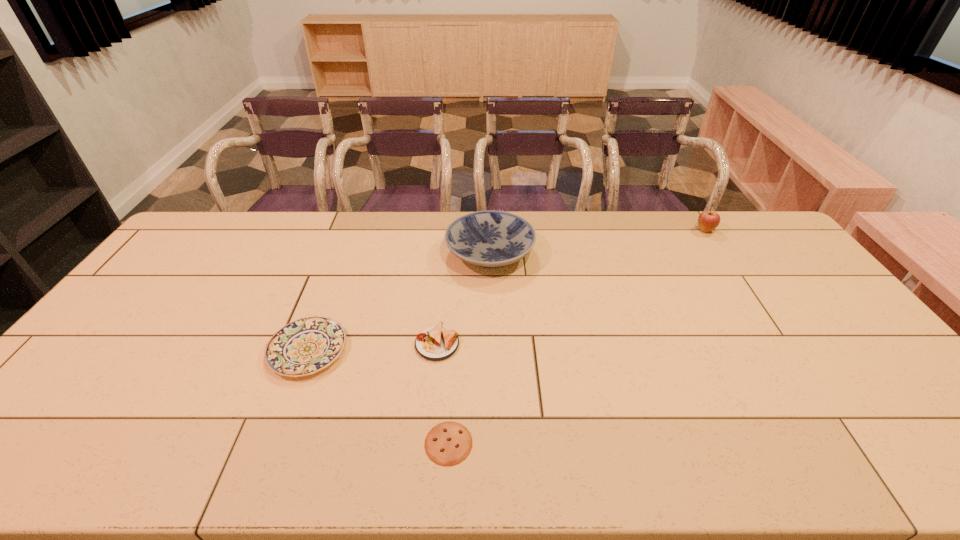
Image resolution: width=960 pixels, height=540 pixels. In order to click on vacant space located 0.050m on the front of the sandwich in this screenshot , I will do `click(434, 377)`.

The width and height of the screenshot is (960, 540). I want to click on blank space located on the right of the fourth tallest object, so pos(380,350).

I want to click on vacant space located 0.110m on the left of the nearest object, so click(x=376, y=443).

At what (x,y) coordinates should I click in order to perform the action: click on apple located in the far edge section of the desktop. Please return your answer as a coordinate pair (x, y). Image resolution: width=960 pixels, height=540 pixels. Looking at the image, I should click on (708, 220).

I want to click on plate present at the far edge, so click(x=491, y=239).

The height and width of the screenshot is (540, 960). What are the coordinates of `object positioned at the near edge` in the screenshot? It's located at (449, 443).

Where is `vacant space at the far edge of the desktop`? This screenshot has height=540, width=960. vacant space at the far edge of the desktop is located at coordinates (391, 215).

You are a GUI agent. You are given a task and a screenshot of the screen. Output one action in this format:
    pyautogui.click(x=<x>, y=<y>)
    Task: Click on the vacant space at the near edge of the desktop
    The height and width of the screenshot is (540, 960).
    Given the screenshot: What is the action you would take?
    pyautogui.click(x=271, y=446)

Where is `free space at the left edge`? free space at the left edge is located at coordinates [x=208, y=255].

Where is `vacant space at the far left corner`? vacant space at the far left corner is located at coordinates (218, 212).